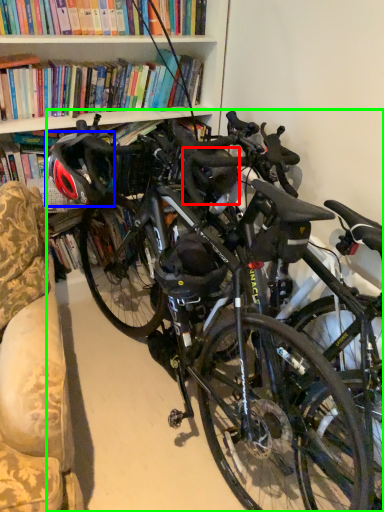
Question: Which is nearer to the helmet (highlighted by a red box)? bicycle helmet (highlighted by a blue box) or bicycle (highlighted by a green box).

Choices:
 (A) bicycle helmet
 (B) bicycle

Answer: (A)